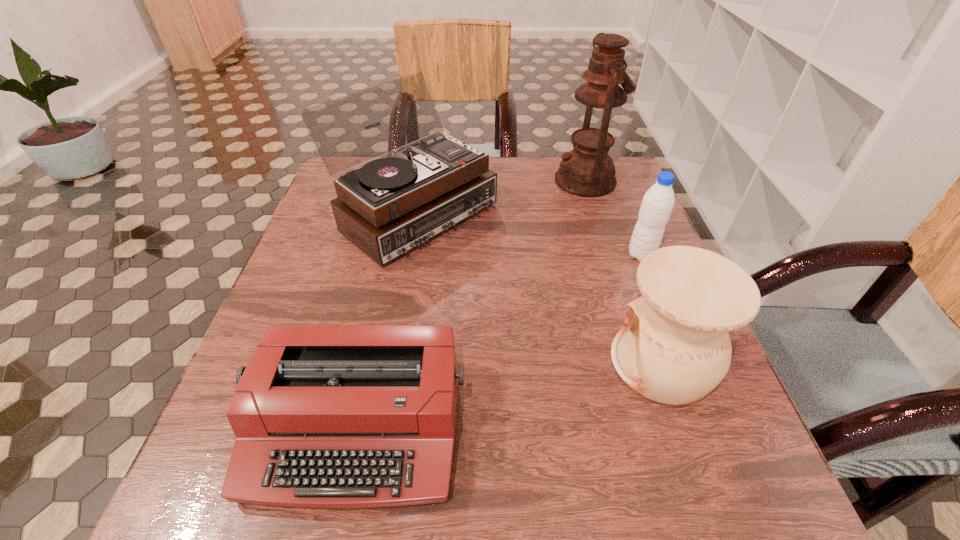
Find the location of a particular element. This screenshot has width=960, height=540. vacant area situated at the open side of the pottery is located at coordinates (465, 363).

Find the location of a particular element. The height and width of the screenshot is (540, 960). oil lamp that is at the far edge is located at coordinates (587, 171).

Identify the location of record player that is at the far edge. (389, 206).

Where is `object that is at the near edge`? The width and height of the screenshot is (960, 540). object that is at the near edge is located at coordinates (325, 416).

Where is `record player present at the left edge`? record player present at the left edge is located at coordinates (389, 206).

This screenshot has width=960, height=540. What are the coordinates of `typewriter situated at the left edge` in the screenshot? It's located at (325, 416).

This screenshot has height=540, width=960. Find the location of `oil lamp that is at the right edge`. oil lamp that is at the right edge is located at coordinates (587, 171).

This screenshot has width=960, height=540. I want to click on water bottle located in the right edge section of the desktop, so (x=658, y=202).

What are the coordinates of `pottery located in the right edge section of the desktop` in the screenshot? It's located at (674, 348).

Identify the location of object positioned at the far left corner. (389, 206).